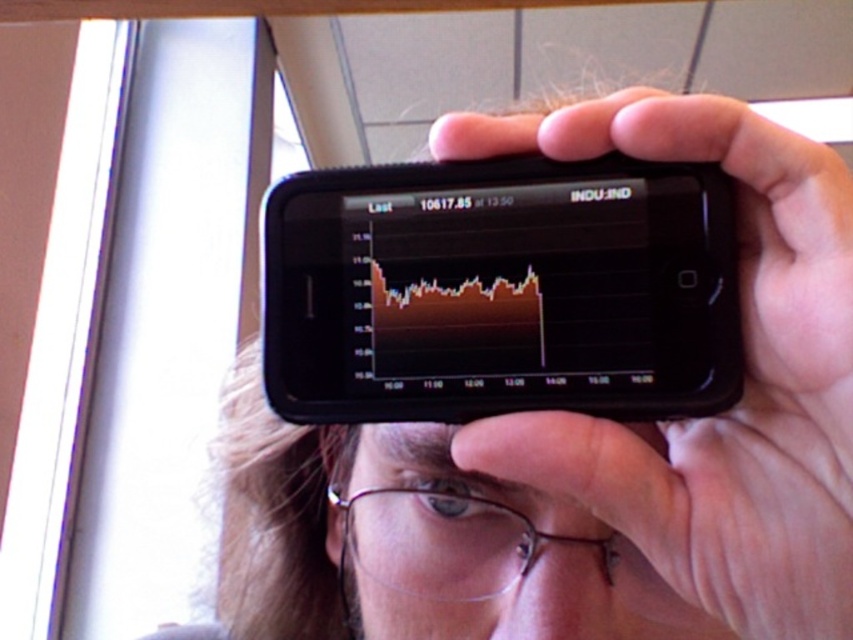
Question: Is black plastic smartphone at upper center to the right of clear plastic glasses at center from the viewer's perspective?

Choices:
 (A) yes
 (B) no

Answer: (A)

Question: Among these objects, which one is farthest from the camera?

Choices:
 (A) black plastic smartphone at upper center
 (B) clear plastic glasses at center
 (C) black matte phone at upper center

Answer: (B)

Question: Does black matte phone at upper center have a greater width compared to clear plastic glasses at center?

Choices:
 (A) yes
 (B) no

Answer: (A)

Question: Which is farther from the black matte phone at upper center?

Choices:
 (A) black plastic smartphone at upper center
 (B) clear plastic glasses at center

Answer: (B)

Question: Among these objects, which one is farthest from the camera?

Choices:
 (A) black matte phone at upper center
 (B) clear plastic glasses at center

Answer: (B)

Question: Does black plastic smartphone at upper center come in front of clear plastic glasses at center?

Choices:
 (A) yes
 (B) no

Answer: (A)